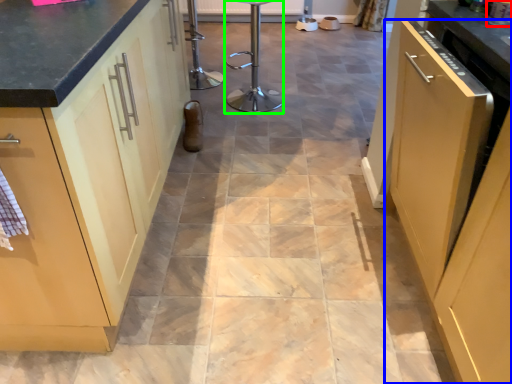
Question: Which object is positioned closest to appliance (highlighted by a red box)? Select from cabinetry (highlighted by a blue box) and bar stool (highlighted by a green box).

Choices:
 (A) cabinetry
 (B) bar stool

Answer: (A)